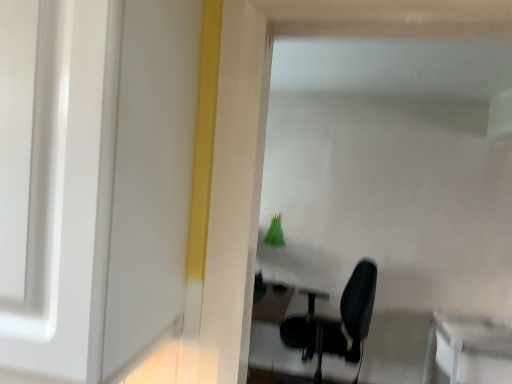
Describe the element at coordinates (335, 324) in the screenshot. I see `black fabric chair at center` at that location.

Identify the location of black fabric chair at center. The image size is (512, 384). (335, 324).

Identify the location of white glossy table at lower right. (469, 348).

Describe the element at coordinates (469, 348) in the screenshot. I see `white glossy table at lower right` at that location.

Measure the distance between white glossy table at lower right and camera.

white glossy table at lower right and camera are 2.51 meters apart.

Where is `black fabric chair at center`? The height and width of the screenshot is (384, 512). black fabric chair at center is located at coordinates (335, 324).

In the image, is black fabric chair at center on the left side or the right side of white glossy table at lower right?

Clearly, black fabric chair at center is on the left of white glossy table at lower right in the image.

Considering their positions, is black fabric chair at center located in front of or behind white glossy table at lower right?

Visually, black fabric chair at center is located behind white glossy table at lower right.

Does point (340, 330) appear closer or farther from the camera than point (498, 332)?

Point (340, 330) is positioned closer to the camera compared to point (498, 332).

From the image's perspective, is black fabric chair at center beneath white glossy table at lower right?

Actually, black fabric chair at center appears above white glossy table at lower right in the image.

Looking at this image, from a real-world perspective, does black fabric chair at center stand above white glossy table at lower right?

Yes, from a real-world perspective, black fabric chair at center is on top of white glossy table at lower right.

Considering the relative sizes of black fabric chair at center and white glossy table at lower right in the image provided, is black fabric chair at center wider than white glossy table at lower right?

Incorrect, the width of black fabric chair at center does not surpass that of white glossy table at lower right.

Who is shorter, black fabric chair at center or white glossy table at lower right?

With less height is white glossy table at lower right.

Can you confirm if black fabric chair at center is bigger than white glossy table at lower right?

Yes, black fabric chair at center is bigger than white glossy table at lower right.

Is black fabric chair at center inside or outside of white glossy table at lower right?

black fabric chair at center exists outside the volume of white glossy table at lower right.

Would you say black fabric chair at center is a long distance from white glossy table at lower right?

No, black fabric chair at center is not far away from white glossy table at lower right.

Is black fabric chair at center turned away from white glossy table at lower right?

Yes, black fabric chair at center is facing away from white glossy table at lower right.

Can you tell me how much black fabric chair at center and white glossy table at lower right differ in facing direction?

85 degrees.

Find the location of a particular element. table lying in front of the black fabric chair at center is located at coordinates (469, 348).

Which is more to the left, white glossy table at lower right or black fabric chair at center?

From the viewer's perspective, black fabric chair at center appears more on the left side.

Is the depth of white glossy table at lower right greater than that of black fabric chair at center?

No, it is in front of black fabric chair at center.

Does point (454, 328) appear closer or farther from the camera than point (339, 354)?

Clearly, point (454, 328) is more distant from the camera than point (339, 354).

From the image's perspective, is white glossy table at lower right above black fabric chair at center?

Incorrect, from the image's perspective, white glossy table at lower right is lower than black fabric chair at center.

From a real-world perspective, is white glossy table at lower right located higher than black fabric chair at center?

No.

Does white glossy table at lower right have a lesser width compared to black fabric chair at center?

No, white glossy table at lower right is not thinner than black fabric chair at center.

Who is shorter, white glossy table at lower right or black fabric chair at center?

white glossy table at lower right.

Does white glossy table at lower right have a smaller size compared to black fabric chair at center?

Indeed, white glossy table at lower right has a smaller size compared to black fabric chair at center.

Is white glossy table at lower right inside or outside of black fabric chair at center?

white glossy table at lower right is not enclosed by black fabric chair at center.

Would you consider white glossy table at lower right to be distant from black fabric chair at center?

No, white glossy table at lower right is not far away from black fabric chair at center.

Is white glossy table at lower right oriented towards black fabric chair at center?

No, white glossy table at lower right is not turned towards black fabric chair at center.

What's the angular difference between white glossy table at lower right and black fabric chair at center's facing directions?

The facing directions of white glossy table at lower right and black fabric chair at center are 85 degrees apart.

You are a GUI agent. You are given a task and a screenshot of the screen. Output one action in this format:
    pyautogui.click(x=<x>, y=<y>)
    Task: Click on the table below the black fabric chair at center (from the image's perspective)
    This screenshot has width=512, height=384.
    Given the screenshot: What is the action you would take?
    pyautogui.click(x=469, y=348)

Find the location of a particular element. table below the black fabric chair at center (from the image's perspective) is located at coordinates (469, 348).

Where is `table in front of the black fabric chair at center`? table in front of the black fabric chair at center is located at coordinates (469, 348).